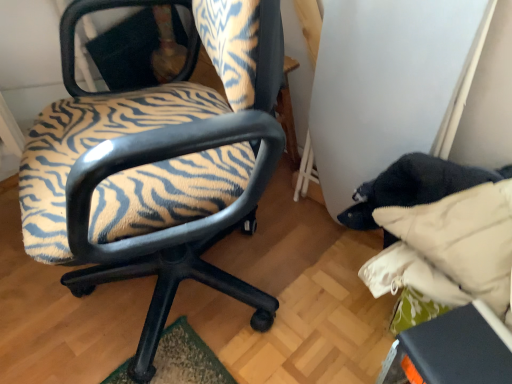
Identify the location of zebra-patterned fabric chair at left. This screenshot has height=384, width=512. (188, 222).

What do you see at coordinates (188, 222) in the screenshot?
I see `zebra-patterned fabric chair at left` at bounding box center [188, 222].

Identify the location of zebra-patterned fabric chair at left. Image resolution: width=512 pixels, height=384 pixels. (x=188, y=222).